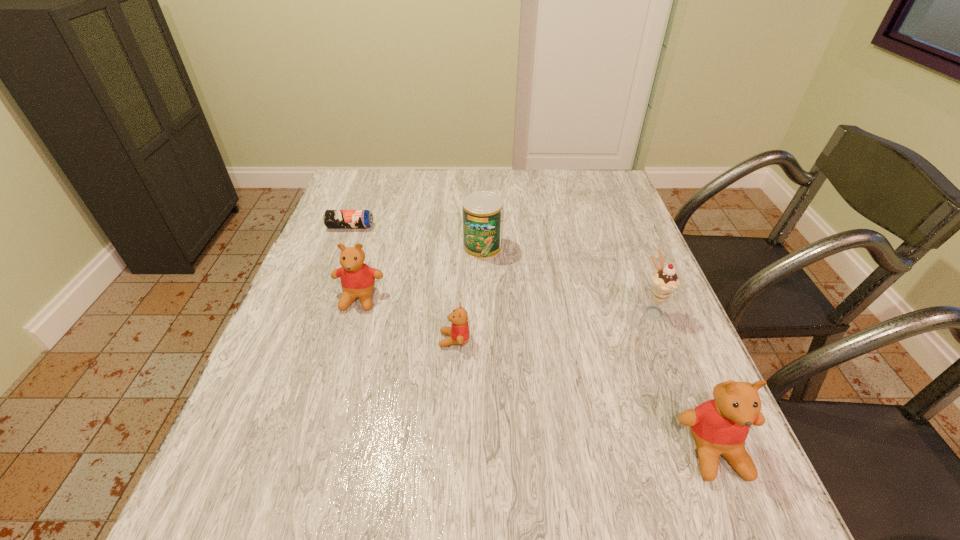
I want to click on the leftmost teddy bear, so click(357, 279).

Image resolution: width=960 pixels, height=540 pixels. I want to click on the second shortest teddy bear, so click(357, 279).

Identify the location of the second shortest object. (459, 331).

Where is `the second farthest teddy bear`? The height and width of the screenshot is (540, 960). the second farthest teddy bear is located at coordinates (459, 331).

Identify the location of the rightmost teddy bear. (720, 426).

Identify the location of the nearest teddy bear. This screenshot has height=540, width=960. (720, 426).

Image resolution: width=960 pixels, height=540 pixels. Identify the location of the second farthest object. (482, 211).

Locate an element on the screen. This screenshot has width=960, height=540. beer can is located at coordinates (332, 218).

The height and width of the screenshot is (540, 960). Find the location of `the farthest object`. the farthest object is located at coordinates (332, 218).

I want to click on icecream, so click(x=664, y=282).